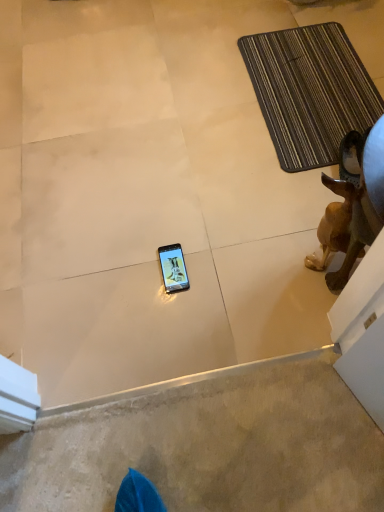
Question: Does brown matte dog at right have a larger size compared to brown striped bath mat at upper right?

Choices:
 (A) yes
 (B) no

Answer: (B)

Question: Could you tell me if brown matte dog at right is turned towards brown striped bath mat at upper right?

Choices:
 (A) yes
 (B) no

Answer: (B)

Question: Considering the relative sizes of brown matte dog at right and brown striped bath mat at upper right in the image provided, is brown matte dog at right taller than brown striped bath mat at upper right?

Choices:
 (A) yes
 (B) no

Answer: (A)

Question: Is brown matte dog at right closer to camera compared to brown striped bath mat at upper right?

Choices:
 (A) no
 (B) yes

Answer: (B)

Question: Is brown matte dog at right shorter than brown striped bath mat at upper right?

Choices:
 (A) no
 (B) yes

Answer: (A)

Question: Looking at their shapes, would you say brown striped bath mat at upper right is wider or thinner than smooth beige carpet at lower center?

Choices:
 (A) thin
 (B) wide

Answer: (B)

Question: In terms of height, does brown striped bath mat at upper right look taller or shorter compared to smooth beige carpet at lower center?

Choices:
 (A) tall
 (B) short

Answer: (A)

Question: Considering the positions of point (289, 45) and point (71, 506), is point (289, 45) closer or farther from the camera than point (71, 506)?

Choices:
 (A) closer
 (B) farther

Answer: (B)

Question: Is brown striped bath mat at upper right in front of or behind smooth beige carpet at lower center in the image?

Choices:
 (A) behind
 (B) front

Answer: (A)

Question: From a real-world perspective, is brown matte dog at right above or below brown striped bath mat at upper right?

Choices:
 (A) above
 (B) below

Answer: (A)

Question: Considering the positions of brown matte dog at right and brown striped bath mat at upper right in the image, is brown matte dog at right wider or thinner than brown striped bath mat at upper right?

Choices:
 (A) thin
 (B) wide

Answer: (A)

Question: Relative to brown striped bath mat at upper right, is brown matte dog at right in front or behind?

Choices:
 (A) behind
 (B) front

Answer: (B)

Question: Would you say brown matte dog at right is to the left or to the right of brown striped bath mat at upper right in the picture?

Choices:
 (A) right
 (B) left

Answer: (B)

Question: Does point (198, 503) appear closer or farther from the camera than point (266, 54)?

Choices:
 (A) farther
 (B) closer

Answer: (B)

Question: In the image, is smooth beige carpet at lower center on the left side or the right side of brown striped bath mat at upper right?

Choices:
 (A) left
 (B) right

Answer: (A)